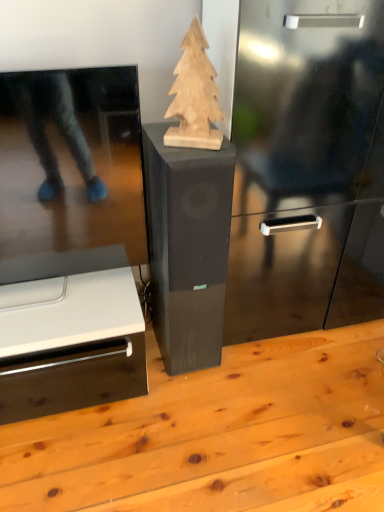
Question: Is black wood speaker at center behind light brown wood table at center?

Choices:
 (A) no
 (B) yes

Answer: (B)

Question: Can you confirm if black wood speaker at center is taller than light brown wood table at center?

Choices:
 (A) yes
 (B) no

Answer: (A)

Question: Is black wood speaker at center looking in the opposite direction of light brown wood table at center?

Choices:
 (A) no
 (B) yes

Answer: (A)

Question: From the image's perspective, does black wood speaker at center appear higher than light brown wood table at center?

Choices:
 (A) no
 (B) yes

Answer: (B)

Question: Does black wood speaker at center appear on the right side of light brown wood table at center?

Choices:
 (A) no
 (B) yes

Answer: (A)

Question: Is black wood speaker at center at the left side of light brown wood table at center?

Choices:
 (A) no
 (B) yes

Answer: (B)

Question: Does light brown wood table at center have a lesser width compared to black wood speaker at center?

Choices:
 (A) no
 (B) yes

Answer: (A)

Question: Considering the relative positions of light brown wood table at center and black wood speaker at center in the image provided, is light brown wood table at center to the left of black wood speaker at center from the viewer's perspective?

Choices:
 (A) no
 (B) yes

Answer: (A)

Question: Is light brown wood table at center behind black wood speaker at center?

Choices:
 (A) no
 (B) yes

Answer: (A)

Question: Would you say light brown wood table at center is outside black wood speaker at center?

Choices:
 (A) yes
 (B) no

Answer: (A)

Question: Is light brown wood table at center looking in the opposite direction of black wood speaker at center?

Choices:
 (A) no
 (B) yes

Answer: (A)

Question: From the image's perspective, is light brown wood table at center located above black wood speaker at center?

Choices:
 (A) no
 (B) yes

Answer: (A)

Question: Does natural wood christmas tree at center have a greater width compared to light brown wood table at center?

Choices:
 (A) yes
 (B) no

Answer: (B)